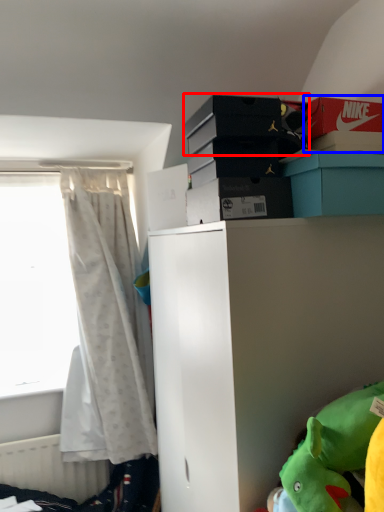
Question: Which object is further to the camera taking this photo, storage box (highlighted by a red box) or storage box (highlighted by a blue box)?

Choices:
 (A) storage box
 (B) storage box

Answer: (B)